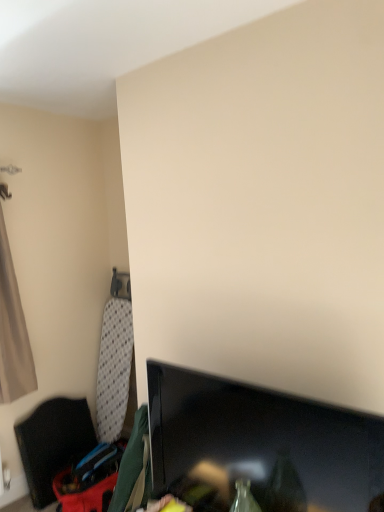
Question: Does black fabric chair at left turn towards beige fabric curtain at left?

Choices:
 (A) yes
 (B) no

Answer: (B)

Question: Does black fabric chair at left lie in front of beige fabric curtain at left?

Choices:
 (A) yes
 (B) no

Answer: (B)

Question: Is black fabric chair at left at the right side of beige fabric curtain at left?

Choices:
 (A) yes
 (B) no

Answer: (A)

Question: Is black fabric chair at left beside beige fabric curtain at left?

Choices:
 (A) yes
 (B) no

Answer: (B)

Question: Can you confirm if black fabric chair at left is taller than beige fabric curtain at left?

Choices:
 (A) no
 (B) yes

Answer: (A)

Question: From a real-world perspective, relative to beige fabric curtain at left, is black fabric chair at left vertically above or below?

Choices:
 (A) above
 (B) below

Answer: (B)

Question: Considering the positions of black fabric chair at left and beige fabric curtain at left in the image, is black fabric chair at left wider or thinner than beige fabric curtain at left?

Choices:
 (A) thin
 (B) wide

Answer: (B)

Question: Is black fabric chair at left to the left or to the right of beige fabric curtain at left in the image?

Choices:
 (A) right
 (B) left

Answer: (A)

Question: Relative to beige fabric curtain at left, is black fabric chair at left in front or behind?

Choices:
 (A) behind
 (B) front

Answer: (A)

Question: Considering the relative positions of black glossy tv at lower right and black fabric chair at left in the image provided, is black glossy tv at lower right to the left or to the right of black fabric chair at left?

Choices:
 (A) left
 (B) right

Answer: (B)

Question: Do you think black glossy tv at lower right is within black fabric chair at left, or outside of it?

Choices:
 (A) inside
 (B) outside

Answer: (B)

Question: Considering the positions of black glossy tv at lower right and black fabric chair at left in the image, is black glossy tv at lower right bigger or smaller than black fabric chair at left?

Choices:
 (A) big
 (B) small

Answer: (B)

Question: Considering the positions of black glossy tv at lower right and black fabric chair at left in the image, is black glossy tv at lower right taller or shorter than black fabric chair at left?

Choices:
 (A) tall
 (B) short

Answer: (B)

Question: Which is correct: beige fabric curtain at left is inside black glossy tv at lower right, or outside of it?

Choices:
 (A) outside
 (B) inside

Answer: (A)

Question: In terms of height, does beige fabric curtain at left look taller or shorter compared to black glossy tv at lower right?

Choices:
 (A) short
 (B) tall

Answer: (B)